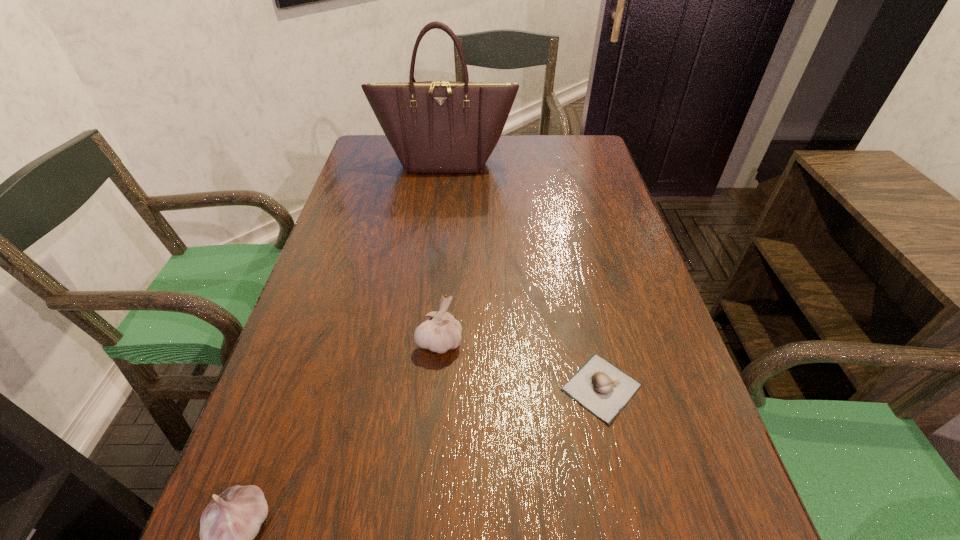
Locate an element on the screen. The height and width of the screenshot is (540, 960). vacant area between the second garlic from right to left and the handbag is located at coordinates (443, 252).

Locate an element on the screen. The width and height of the screenshot is (960, 540). unoccupied position between the tallest object and the second garlic from right to left is located at coordinates (443, 252).

Identify which object is located as the second nearest to the leftmost garlic. Please provide its 2D coordinates. Your answer should be formatted as a tuple, i.e. [(x, y)], where the tuple contains the x and y coordinates of a point satisfying the conditions above.

[(602, 388)]

Choose which object is the nearest neighbor to the tallest object. Please provide its 2D coordinates. Your answer should be formatted as a tuple, i.e. [(x, y)], where the tuple contains the x and y coordinates of a point satisfying the conditions above.

[(440, 332)]

Identify the location of garlic that is the closest to the shortest garlic. (440, 332).

Where is `garlic that stands as the second closest to the second garlic from right to left`? This screenshot has height=540, width=960. garlic that stands as the second closest to the second garlic from right to left is located at coordinates (228, 525).

Find the location of `vacant area in the image that satisfies the following two spatial constraints: 1. on the front-facing side of the second garlic from right to left; 2. on the right side of the farthest object`. vacant area in the image that satisfies the following two spatial constraints: 1. on the front-facing side of the second garlic from right to left; 2. on the right side of the farthest object is located at coordinates (424, 342).

You are a GUI agent. You are given a task and a screenshot of the screen. Output one action in this format:
    pyautogui.click(x=<x>, y=<y>)
    Task: Click on the vacant space that satisfies the following two spatial constraints: 1. on the front-facing side of the tallest object; 2. on the left side of the rightmost garlic
    This screenshot has width=960, height=540.
    Given the screenshot: What is the action you would take?
    pyautogui.click(x=420, y=387)

What are the coordinates of `vacant space that satisfies the following two spatial constraints: 1. on the front-facing side of the second garlic from right to left; 2. on the left side of the tallest object` in the screenshot? It's located at (424, 342).

Locate an element on the screen. vacant space that satisfies the following two spatial constraints: 1. on the front-facing side of the handbag; 2. on the left side of the second garlic from right to left is located at coordinates (424, 342).